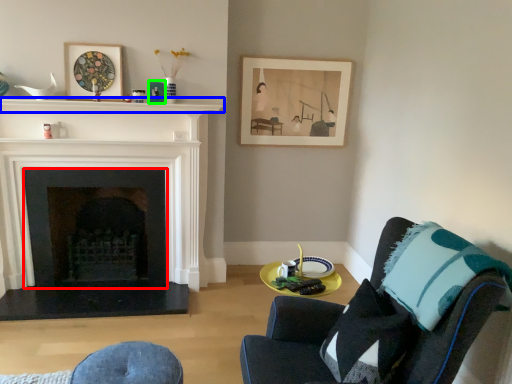
Question: Which object is the closest to the fireplace (highlighted by a red box)? Choose among these: mantle (highlighted by a blue box) or picture frame (highlighted by a green box).

Choices:
 (A) mantle
 (B) picture frame

Answer: (A)